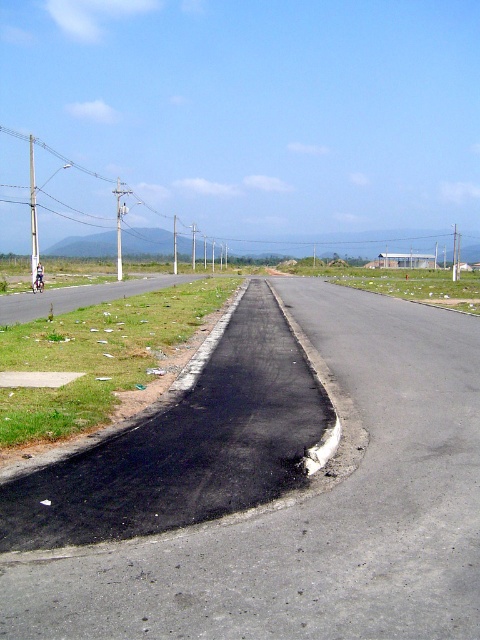
You are a drone operator trying to map a newly paved road. You have two points marked on your screen, point A at coordinates point (37, 288) and point B at coordinates point (38, 284). According to the scene, which point is closer to the road surface?

Point (37, 288) is closer to the road surface because it is closer to the viewer than point (38, 284).

You are a delivery driver who needs to pass through the road shown in the image. There is a blue fabric motorcyclist at center and a metallic silver motorcycle at center. Can you safely pass between them without hitting either?

The distance between the blue fabric motorcyclist at center and the metallic silver motorcycle at center is 0.71 inches, which is extremely narrow. It would not be safe to attempt passing between them as there is insufficient space to maneuver safely.